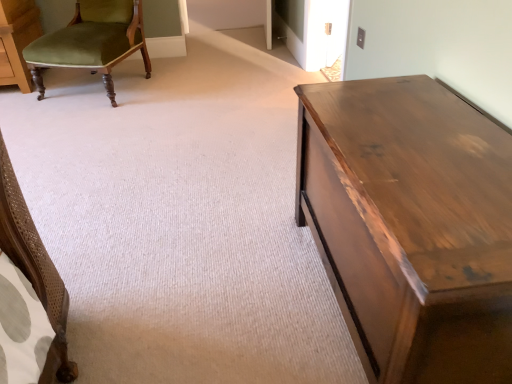
Locate an element on the screen. The height and width of the screenshot is (384, 512). vacant space underneath green velvet chair at upper left (from a real-world perspective) is located at coordinates (102, 84).